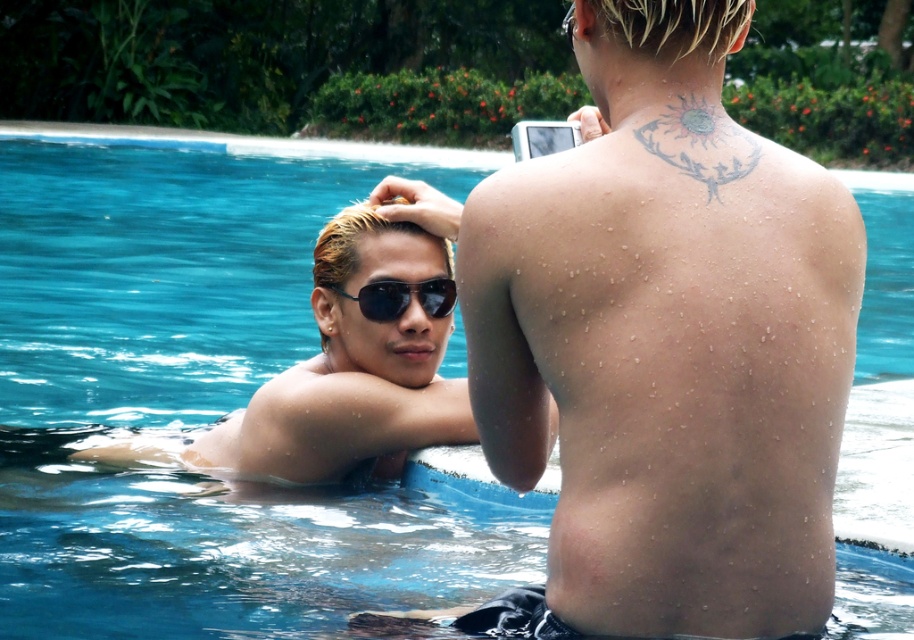
Is sunglasses at upper center smaller than gray ink sun at upper back?

Incorrect, sunglasses at upper center is not smaller in size than gray ink sun at upper back.

Is point (200, 461) closer to camera compared to point (721, 128)?

No.

Where is `sunglasses at upper center`? The width and height of the screenshot is (914, 640). sunglasses at upper center is located at coordinates (354, 365).

Which of these two, shiny wet skin at upper right or gray ink sun at upper back, stands shorter?

gray ink sun at upper back

Does shiny wet skin at upper right have a smaller size compared to gray ink sun at upper back?

No.

Which is in front, point (808, 504) or point (720, 170)?

Point (808, 504)

At what (x,y) coordinates should I click in order to perform the action: click on shiny wet skin at upper right. Please return your answer as a coordinate pair (x, y). The image size is (914, 640). Looking at the image, I should click on (667, 339).

Is gray ink sun at upper back above black reflective sunglasses at upper center?

Yes, gray ink sun at upper back is above black reflective sunglasses at upper center.

Is point (689, 97) positioned in front of point (373, 305)?

Yes, point (689, 97) is in front of point (373, 305).

Find the location of a particular element. Image resolution: width=914 pixels, height=640 pixels. gray ink sun at upper back is located at coordinates (700, 141).